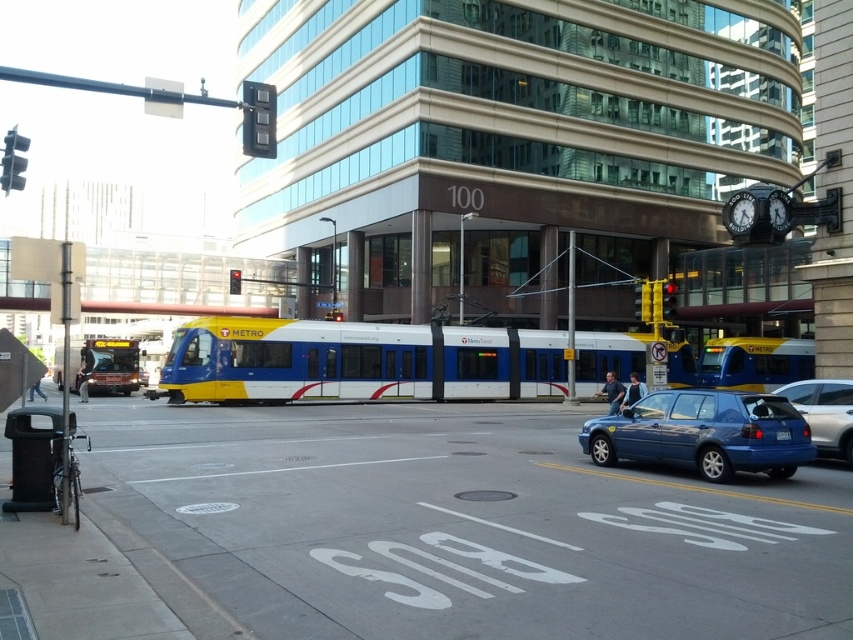
You are a pedestrian standing at the bus stop. You see a metallic blue hatchback at lower right and a yellow plastic traffic light at upper right. Which object is taller?

The yellow plastic traffic light at upper right is taller than the metallic blue hatchback at lower right.

Looking at this image, you are standing at the bus stop marked by white lettering on the asphalt and want to walk to the clock on the building that reads 10.10. There are two points on your path labeled as point (x=792, y=472) and point (x=651, y=282). Which point should you step on first to reach the clock?

You should step on point (x=792, y=472) first because it is in front of point (x=651, y=282), so it comes before the latter in your path towards the clock.

You are standing at the bus stop marked by white lettering on the asphalt. You want to reach the point located at coordinates point (267, 129). Can you walk straight from your current position to that point without needing to go around anything?

The distance between point (267, 129) and the viewer is 14.28 meters. Since there are no obstacles mentioned in the scene description, you can walk straight to the point.